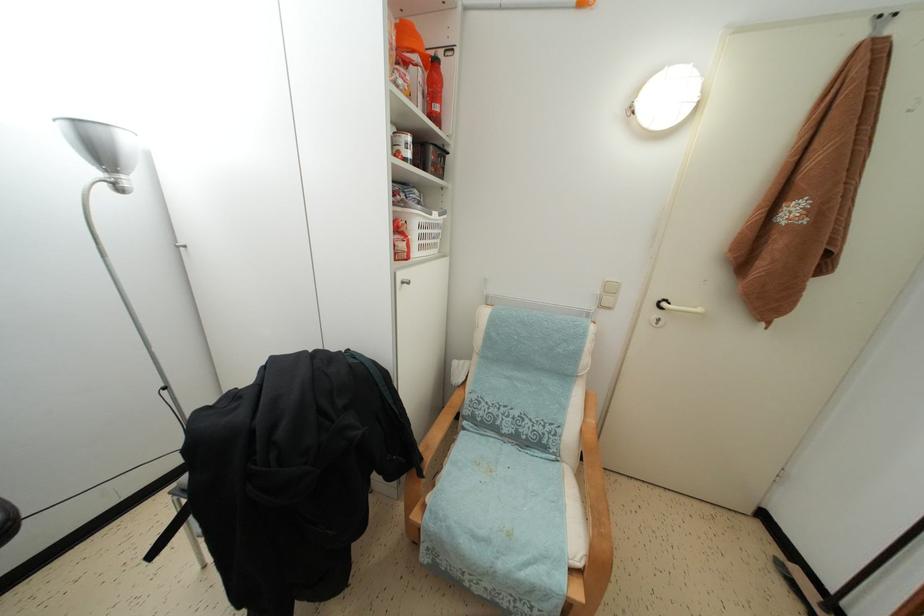
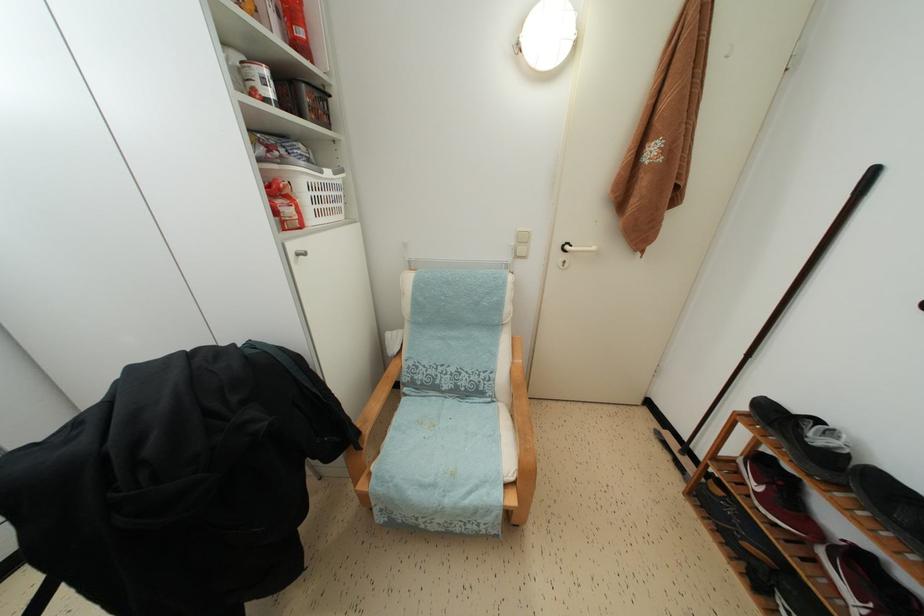
In the second image, find the point that corresponds to point 412,160 in the first image.

(274, 100)